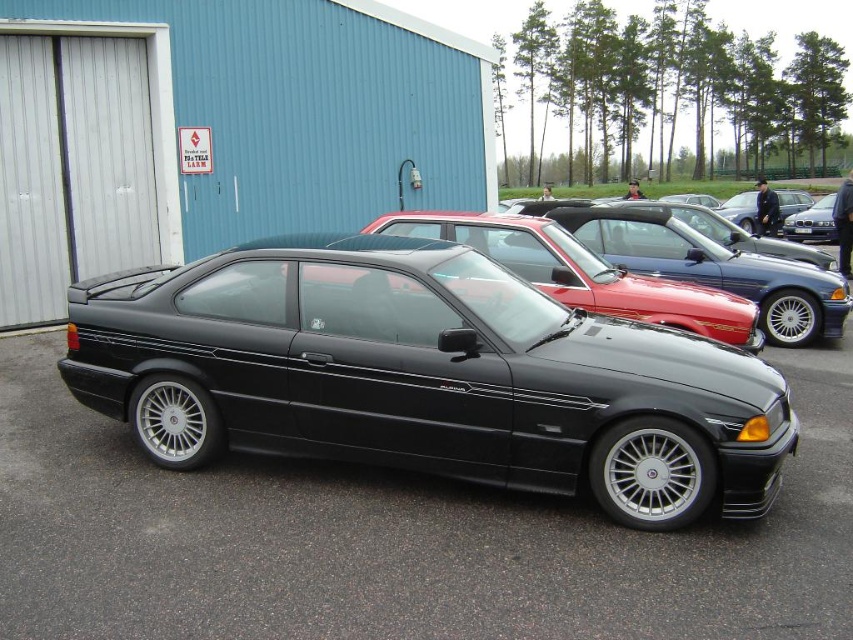
You are a delivery person trying to park your van in the parking lot. You see the glossy black car at center and the glossy black sedan at center. Which one is closer to the ground?

The glossy black car at center is below the glossy black sedan at center, so it is closer to the ground.

You are a delivery driver who needs to park your van next to the glossy black car at center and the glossy black sedan at center. Which one has more space available next to it for your van?

The glossy black car at center is wider than the glossy black sedan at center, so there is less space available next to it. Therefore, the glossy black sedan at center would have more space for your van.